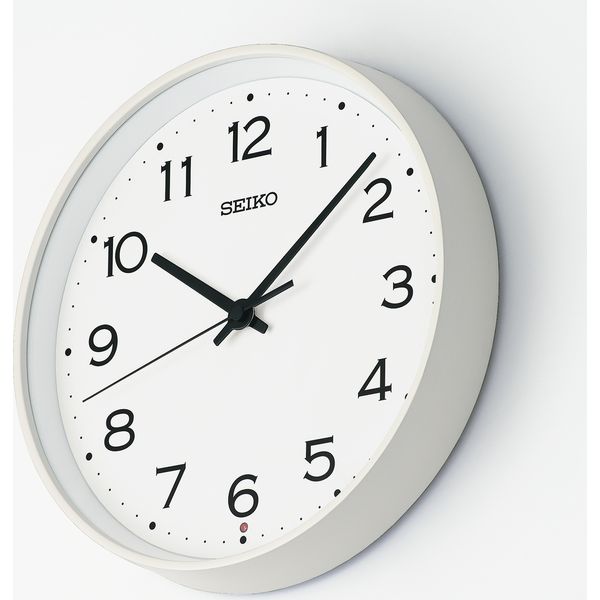
Locate an element on the screen. Image resolution: width=600 pixels, height=600 pixels. circular white frame is located at coordinates (454, 236).